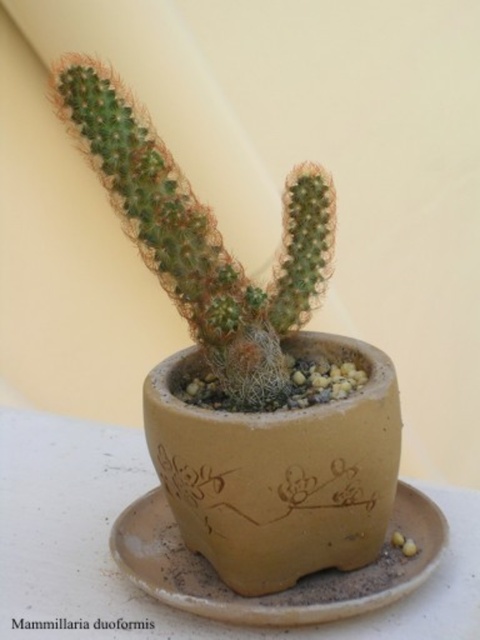
Question: Which object appears closest to the camera in this image?

Choices:
 (A) brown matte saucer at center
 (B) green spiky cactus at center

Answer: (A)

Question: Estimate the real-world distances between objects in this image. Which object is farther from the brown matte saucer at center?

Choices:
 (A) green spiky cactus at center
 (B) green matte mammillaria duoformis at center

Answer: (A)

Question: Is green spiky cactus at center below green matte mammillaria duoformis at center?

Choices:
 (A) no
 (B) yes

Answer: (A)

Question: Does brown matte saucer at center have a greater width compared to green matte mammillaria duoformis at center?

Choices:
 (A) no
 (B) yes

Answer: (B)

Question: Does brown matte saucer at center have a greater width compared to green matte mammillaria duoformis at center?

Choices:
 (A) no
 (B) yes

Answer: (B)

Question: Estimate the real-world distances between objects in this image. Which object is farther from the green matte mammillaria duoformis at center?

Choices:
 (A) green spiky cactus at center
 (B) brown matte saucer at center

Answer: (A)